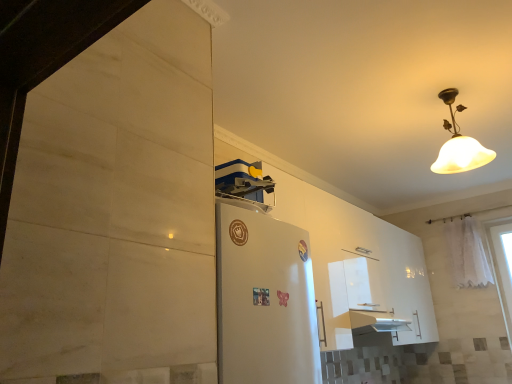
In order to face white matte lampshade at upper right, should I rotate leftwards or rightwards?

To face it directly, rotate right by 24.962 degrees.

Describe the element at coordinates (459, 145) in the screenshot. I see `white matte lampshade at upper right` at that location.

Where is `white matte lampshade at upper right`? This screenshot has width=512, height=384. white matte lampshade at upper right is located at coordinates tap(459, 145).

In order to face white sheer curtain at right, should I rotate leftwards or rightwards?

Turn right by 26.312 degrees to look at white sheer curtain at right.

What do you see at coordinates (466, 254) in the screenshot? Image resolution: width=512 pixels, height=384 pixels. I see `white sheer curtain at right` at bounding box center [466, 254].

Where is `white sheer curtain at right`? The width and height of the screenshot is (512, 384). white sheer curtain at right is located at coordinates (466, 254).

Where is `white matte lampshade at upper right`? This screenshot has height=384, width=512. white matte lampshade at upper right is located at coordinates (459, 145).

Based on their positions, is white sheer curtain at right located to the left or right of white matte lampshade at upper right?

In the image, white sheer curtain at right appears on the right side of white matte lampshade at upper right.

From the picture: Which object is more forward, white sheer curtain at right or white matte lampshade at upper right?

white matte lampshade at upper right is closer to the camera.

Considering the positions of points (468, 274) and (448, 141), is point (468, 274) farther from camera compared to point (448, 141)?

Yes.

From the image's perspective, is white sheer curtain at right beneath white matte lampshade at upper right?

Yes, from the image's perspective, white sheer curtain at right is beneath white matte lampshade at upper right.

From a real-world perspective, is white sheer curtain at right above or below white matte lampshade at upper right?

From a real-world perspective, white sheer curtain at right is physically below white matte lampshade at upper right.

Is white sheer curtain at right wider than white matte lampshade at upper right?

No, white sheer curtain at right is not wider than white matte lampshade at upper right.

In terms of height, does white sheer curtain at right look taller or shorter compared to white matte lampshade at upper right?

Clearly, white sheer curtain at right is taller compared to white matte lampshade at upper right.

Based on their sizes in the image, would you say white sheer curtain at right is bigger or smaller than white matte lampshade at upper right?

Considering their sizes, white sheer curtain at right takes up less space than white matte lampshade at upper right.

Is white sheer curtain at right completely or partially outside of white matte lampshade at upper right?

Indeed, white sheer curtain at right is completely outside white matte lampshade at upper right.

Is the surface of white sheer curtain at right in direct contact with white matte lampshade at upper right?

No, white sheer curtain at right is not next to white matte lampshade at upper right.

Could you tell me if white sheer curtain at right is turned towards white matte lampshade at upper right?

Yes, white sheer curtain at right is turned towards white matte lampshade at upper right.

Can you tell me how much white sheer curtain at right and white matte lampshade at upper right differ in facing direction?

There is a 83.9-degree angle between the facing directions of white sheer curtain at right and white matte lampshade at upper right.

I want to click on lamp above the white sheer curtain at right (from a real-world perspective), so (459, 145).

Considering the relative positions of white matte lampshade at upper right and white sheer curtain at right in the image provided, is white matte lampshade at upper right to the right of white sheer curtain at right from the viewer's perspective?

In fact, white matte lampshade at upper right is to the left of white sheer curtain at right.

Is white matte lampshade at upper right further to the viewer compared to white sheer curtain at right?

No, it is not.

Is point (460, 162) behind point (466, 242)?

No.

From the image's perspective, who appears lower, white matte lampshade at upper right or white sheer curtain at right?

white sheer curtain at right is shown below in the image.

From a real-world perspective, is white matte lampshade at upper right positioned above or below white sheer curtain at right?

white matte lampshade at upper right is situated higher than white sheer curtain at right in the real world.

Considering the sizes of objects white matte lampshade at upper right and white sheer curtain at right in the image provided, who is thinner, white matte lampshade at upper right or white sheer curtain at right?

white sheer curtain at right.

Considering the sizes of objects white matte lampshade at upper right and white sheer curtain at right in the image provided, who is shorter, white matte lampshade at upper right or white sheer curtain at right?

white matte lampshade at upper right.

Between white matte lampshade at upper right and white sheer curtain at right, which one has larger size?

Bigger between the two is white matte lampshade at upper right.

Looking at this image, which is correct: white matte lampshade at upper right is inside white sheer curtain at right, or outside of it?

white matte lampshade at upper right is not inside white sheer curtain at right, it's outside.

Is white matte lampshade at upper right placed right next to white sheer curtain at right?

No, white matte lampshade at upper right is not beside white sheer curtain at right.

Is white sheer curtain at right at the back of white matte lampshade at upper right?

That's not correct — white matte lampshade at upper right is not looking away from white sheer curtain at right.

Where is `lamp in front of the white sheer curtain at right`? The image size is (512, 384). lamp in front of the white sheer curtain at right is located at coordinates (459, 145).

Where is `lamp on the left of the white sheer curtain at right`? This screenshot has height=384, width=512. lamp on the left of the white sheer curtain at right is located at coordinates (459, 145).

Where is `lamp in front of the white sheer curtain at right`? lamp in front of the white sheer curtain at right is located at coordinates (459, 145).